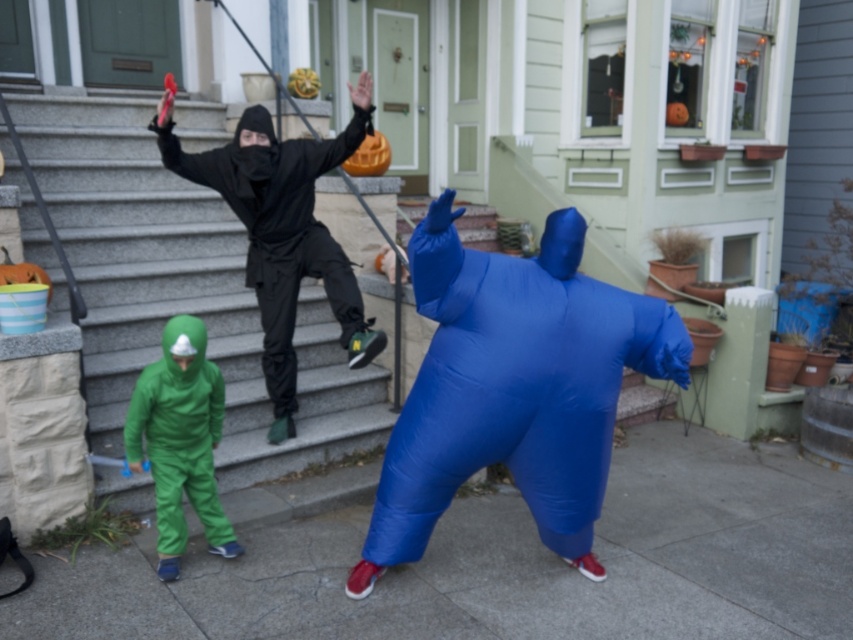
Question: Does blue inflatable at center appear under green matte suit at lower left?

Choices:
 (A) no
 (B) yes

Answer: (A)

Question: Among these points, which one is nearest to the camera?

Choices:
 (A) (154, 458)
 (B) (212, 301)
 (C) (314, 236)

Answer: (A)

Question: Among these objects, which one is nearest to the camera?

Choices:
 (A) blue inflatable at center
 (B) matte black ninja at upper center

Answer: (A)

Question: Can you confirm if blue inflatable at center is positioned above matte black ninja at upper center?

Choices:
 (A) yes
 (B) no

Answer: (B)

Question: Which object is farther from the camera taking this photo?

Choices:
 (A) blue inflatable at center
 (B) green matte suit at lower left

Answer: (B)

Question: Is blue inflatable at center bigger than green matte suit at lower left?

Choices:
 (A) yes
 (B) no

Answer: (A)